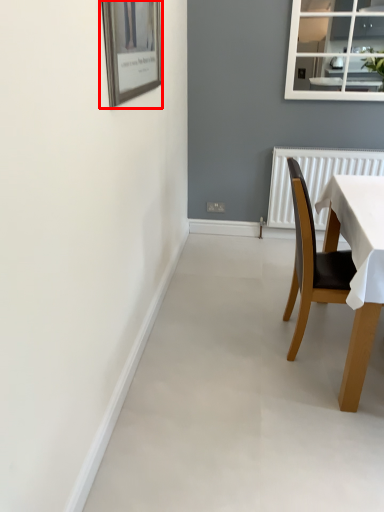
Question: Observing the image, what is the correct spatial positioning of picture frame (annotated by the red box) in reference to chair?

Choices:
 (A) left
 (B) right

Answer: (A)